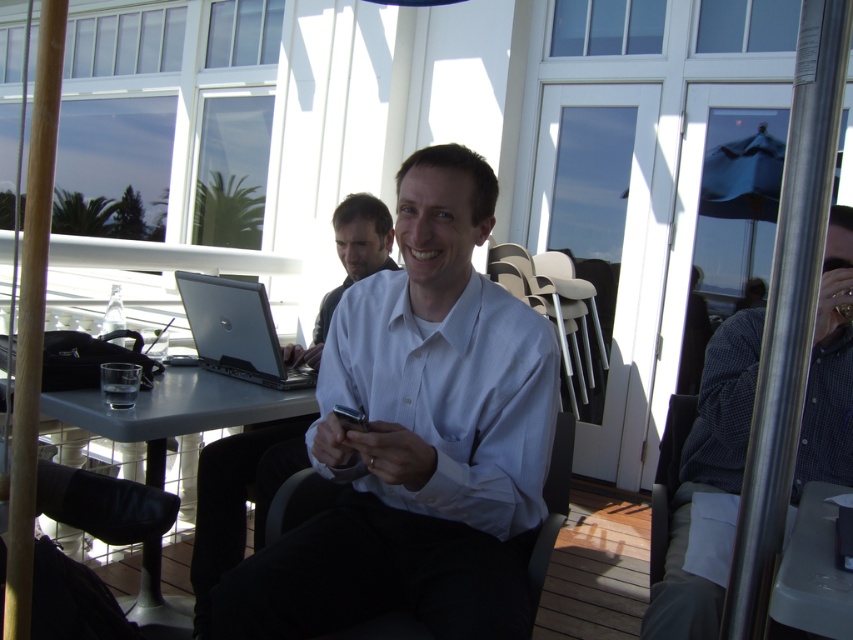
Question: Based on their relative distances, which object is nearer to the black fabric chair at center?

Choices:
 (A) dark gray fabric chair at right
 (B) sleek silver laptop at center
 (C) checkered shirt at right
 (D) gray plastic table at center

Answer: (D)

Question: Does white smooth shirt at center have a greater width compared to sleek silver laptop at center?

Choices:
 (A) yes
 (B) no

Answer: (A)

Question: Does white smooth dress shirt at center lie in front of white glossy shirt at center?

Choices:
 (A) yes
 (B) no

Answer: (A)

Question: Which of the following is the closest to the observer?

Choices:
 (A) gray plastic table at center
 (B) white smooth shirt at center
 (C) dark gray fabric chair at right

Answer: (B)

Question: Which is farther from the white smooth dress shirt at center?

Choices:
 (A) checkered shirt at right
 (B) white plastic table at lower right
 (C) white smooth shirt at center
 (D) dark gray fabric chair at right

Answer: (B)

Question: Is white smooth dress shirt at center closer to the viewer compared to sleek silver laptop at center?

Choices:
 (A) no
 (B) yes

Answer: (B)